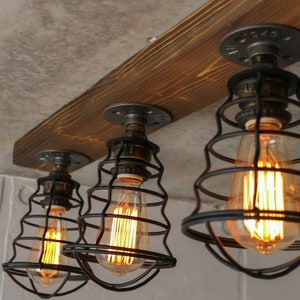
The image size is (300, 300). In order to click on wall in this screenshot , I will do `click(190, 268)`.